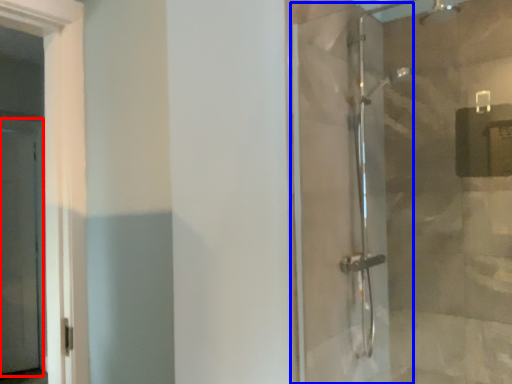
Question: Which of the following is the farthest to the observer, screen door (highlighted by a red box) or shower door (highlighted by a blue box)?

Choices:
 (A) screen door
 (B) shower door

Answer: (A)